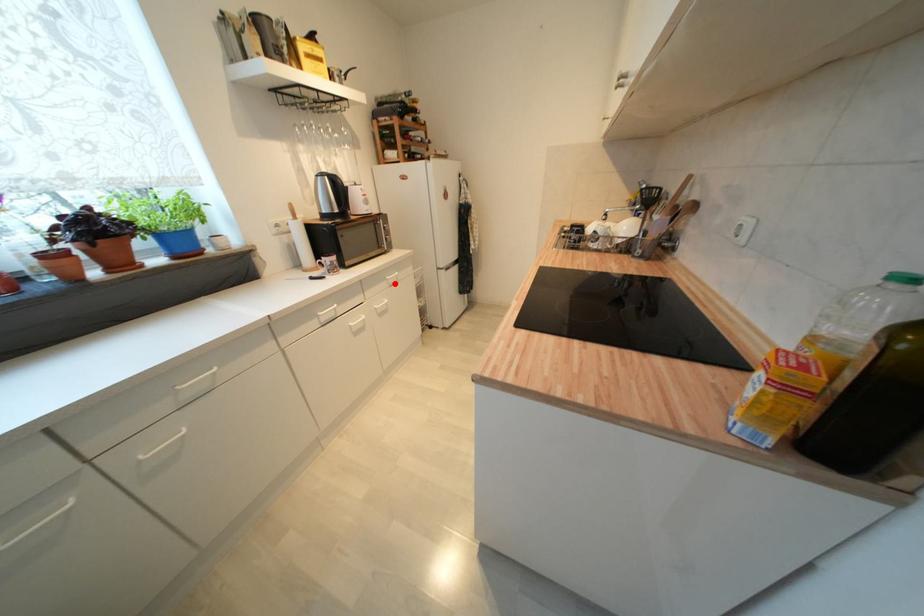
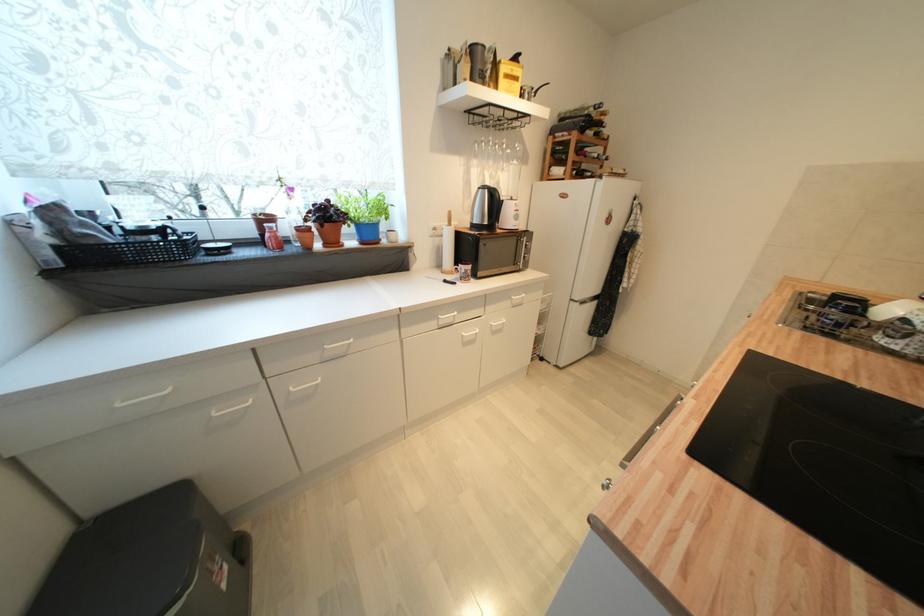
Question: I am providing you with two images of the same scene from different viewpoints. In image1, a red point is highlighted. Considering the same 3D point in image2, which of the following is correct?

Choices:
 (A) It is closer
 (B) It is farther

Answer: (B)